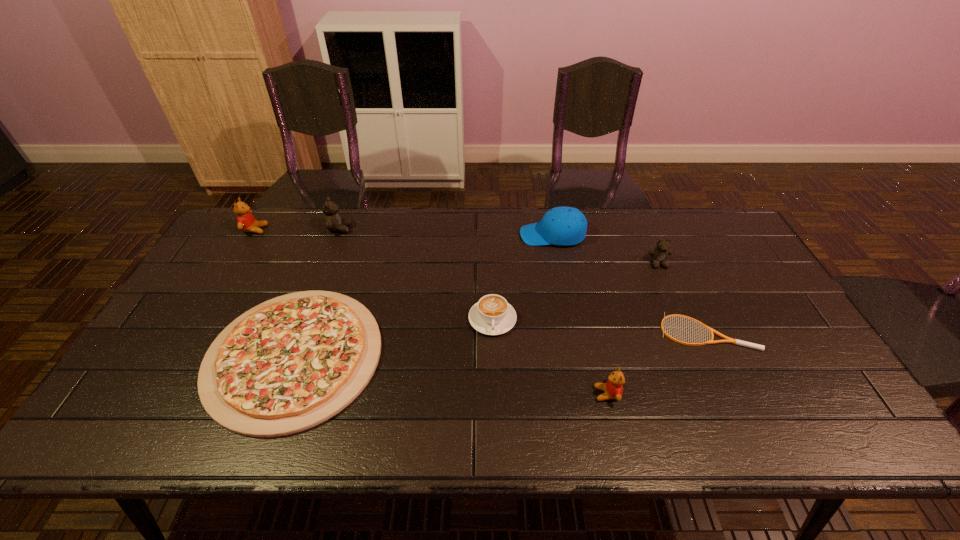
Identify the location of the fourth object from left to right. (492, 315).

At what (x,y) coordinates should I click in order to perform the action: click on the second shortest object. Please return your answer as a coordinate pair (x, y). Looking at the image, I should click on (293, 362).

You are a GUI agent. You are given a task and a screenshot of the screen. Output one action in this format:
    pyautogui.click(x=<x>, y=<y>)
    Task: Click on the beige tennis racket
    Image resolution: width=960 pixels, height=540 pixels.
    Given the screenshot: What is the action you would take?
    pyautogui.click(x=728, y=340)

Locate an element on the screen. tennis racket is located at coordinates (728, 340).

Image resolution: width=960 pixels, height=540 pixels. I want to click on free region located 0.200m on the front-facing side of the farther red teddy bear, so click(x=324, y=230).

Where is `free spot located on the face of the bigger brown teddy bear`? The image size is (960, 540). free spot located on the face of the bigger brown teddy bear is located at coordinates (442, 229).

I want to click on vacant space located 0.080m on the front-facing side of the cap, so click(x=496, y=235).

Image resolution: width=960 pixels, height=540 pixels. What are the coordinates of `vacant space situated 0.060m on the front-facing side of the cap` in the screenshot? It's located at (502, 235).

Locate an element on the screen. free location located 0.050m on the front-facing side of the cap is located at coordinates (505, 235).

The image size is (960, 540). Identify the location of vacant space located 0.300m on the face of the nearer brown teddy bear. (695, 348).